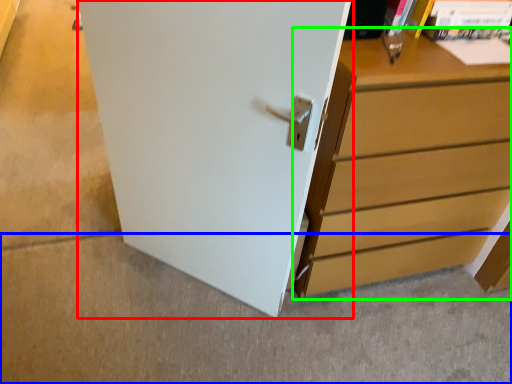
Question: Based on their relative distances, which object is farther from door (highlighted by a red box)? Choose from concrete (highlighted by a blue box) and chest of drawers (highlighted by a green box).

Choices:
 (A) concrete
 (B) chest of drawers

Answer: (A)